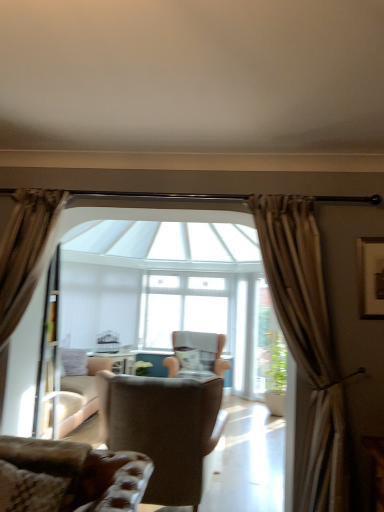
Question: Does velvet brown armchair at center, acting as the third chair starting from the front, lie in front of leather at lower left, which appears as the 1th chair when viewed from the front?

Choices:
 (A) no
 (B) yes

Answer: (A)

Question: From the image's perspective, is velvet brown armchair at center, acting as the third chair starting from the front, above leather at lower left, which appears as the 1th chair when viewed from the front?

Choices:
 (A) no
 (B) yes

Answer: (A)

Question: From the image's perspective, would you say velvet brown armchair at center, acting as the first chair starting from the back, is shown under leather at lower left, which ranks as the 3th chair in back-to-front order?

Choices:
 (A) yes
 (B) no

Answer: (A)

Question: Considering the relative sizes of velvet brown armchair at center, acting as the third chair starting from the front, and leather at lower left, which ranks as the 3th chair in back-to-front order, in the image provided, is velvet brown armchair at center, acting as the third chair starting from the front, shorter than leather at lower left, which ranks as the 3th chair in back-to-front order,?

Choices:
 (A) yes
 (B) no

Answer: (B)

Question: Is velvet brown armchair at center, acting as the first chair starting from the back, to the left of leather at lower left, which appears as the 1th chair when viewed from the front, from the viewer's perspective?

Choices:
 (A) no
 (B) yes

Answer: (A)

Question: Can you confirm if velvet brown armchair at center, acting as the third chair starting from the front, is taller than leather at lower left, which appears as the 1th chair when viewed from the front?

Choices:
 (A) yes
 (B) no

Answer: (A)

Question: Does velvet brown armchair at center, acting as the third chair starting from the front, appear on the left side of wooden framed artwork at upper right?

Choices:
 (A) no
 (B) yes

Answer: (B)

Question: Is velvet brown armchair at center, acting as the third chair starting from the front, facing towards wooden framed artwork at upper right?

Choices:
 (A) yes
 (B) no

Answer: (A)

Question: From a real-world perspective, is velvet brown armchair at center, acting as the third chair starting from the front, positioned over wooden framed artwork at upper right based on gravity?

Choices:
 (A) no
 (B) yes

Answer: (A)

Question: Is velvet brown armchair at center, acting as the first chair starting from the back, thinner than wooden framed artwork at upper right?

Choices:
 (A) no
 (B) yes

Answer: (A)

Question: Is velvet brown armchair at center, acting as the first chair starting from the back, to the right of wooden framed artwork at upper right from the viewer's perspective?

Choices:
 (A) no
 (B) yes

Answer: (A)

Question: From a real-world perspective, is velvet brown armchair at center, acting as the first chair starting from the back, physically below wooden framed artwork at upper right?

Choices:
 (A) no
 (B) yes

Answer: (B)

Question: Is velvet brown armchair at center, acting as the first chair starting from the back, facing away from velvet gray pillow at center?

Choices:
 (A) yes
 (B) no

Answer: (A)